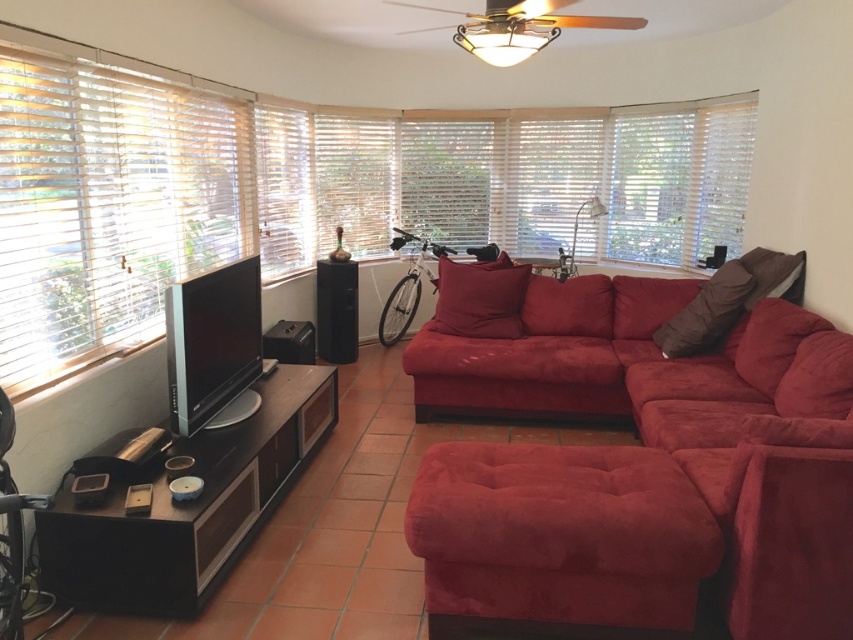
You are an interior designer planning to place a new speaker in the living room. You have a choice between two speakers, one the same size as the black matte speaker at center and another twice as large. Which speaker size would fit better near the white wood blinds at left without overcrowding the space?

The speaker twice as large as the black matte speaker at center would fit better near the white wood blinds at left since the white wood blinds at left is larger in size than the black matte speaker at center, providing more space for a larger speaker.